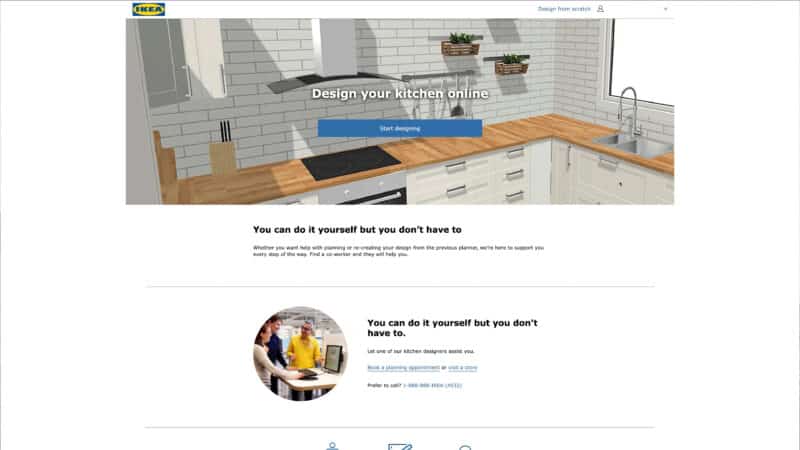
Where is `stove cooktop`? The image size is (800, 450). stove cooktop is located at coordinates (x=354, y=150).